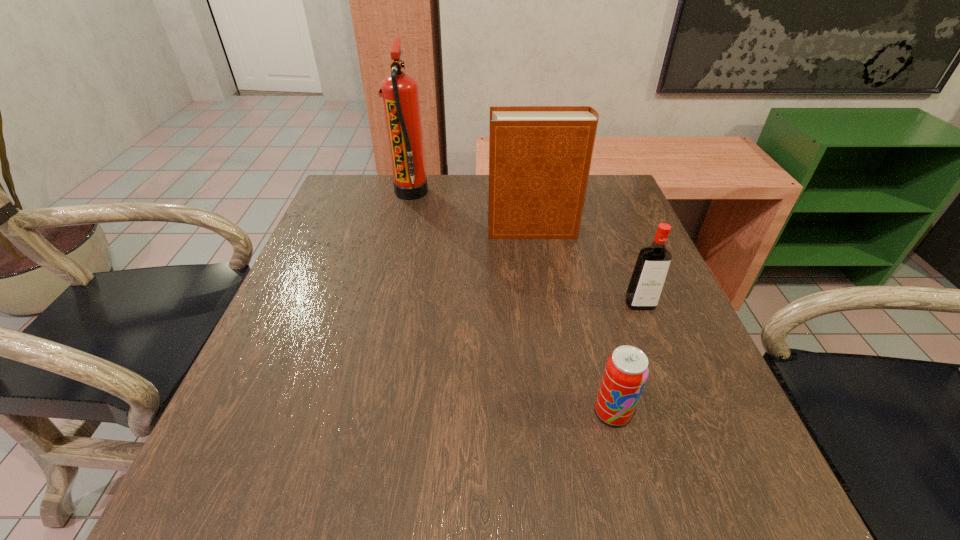
Find the location of `object located at the far left corner`. object located at the far left corner is located at coordinates (400, 93).

Identify the location of object situated at the far right corner. The height and width of the screenshot is (540, 960). (539, 156).

Where is `vacant space at the far edge`? The image size is (960, 540). vacant space at the far edge is located at coordinates (439, 175).

Where is `free space at the near edge`? The image size is (960, 540). free space at the near edge is located at coordinates (301, 513).

Locate an element on the screen. This screenshot has height=540, width=960. vacant space at the left edge of the desktop is located at coordinates (313, 308).

Locate an element on the screen. This screenshot has height=540, width=960. blank space at the right edge of the desktop is located at coordinates (671, 342).

This screenshot has width=960, height=540. What are the coordinates of `vacant space at the far right corner` in the screenshot? It's located at (597, 195).

Identify the location of vacant area at the near right corner. (717, 496).

Where is `unoccupied position between the third shortest object and the rightmost object`? The width and height of the screenshot is (960, 540). unoccupied position between the third shortest object and the rightmost object is located at coordinates (587, 267).

Where is `empty space that is in between the shortest object and the second farthest object`? This screenshot has width=960, height=540. empty space that is in between the shortest object and the second farthest object is located at coordinates (573, 321).